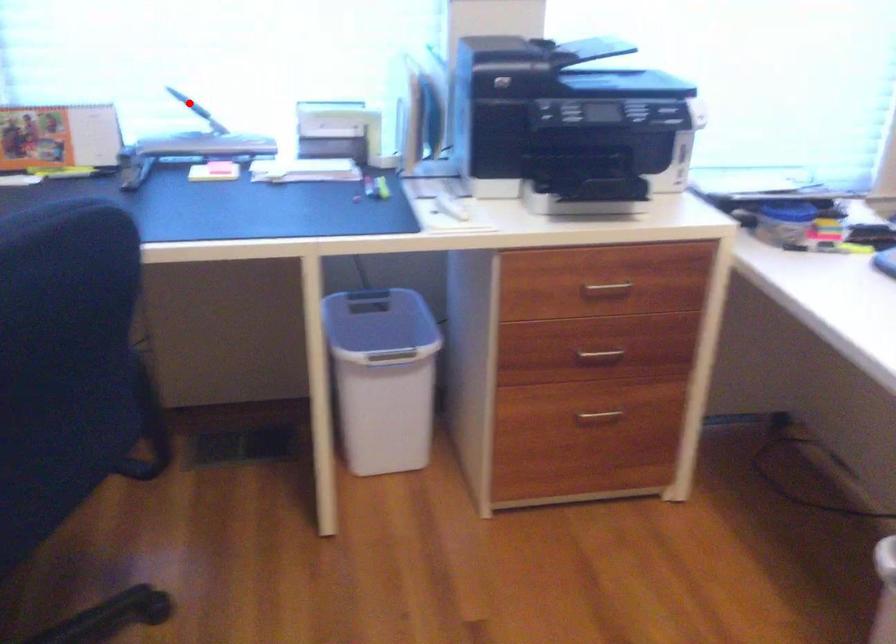
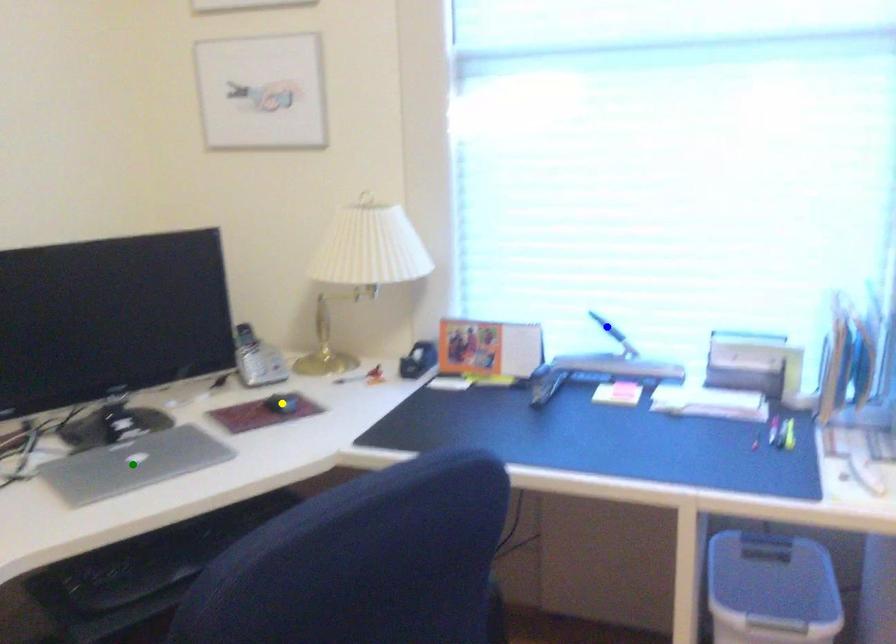
Question: I am providing you with two images of the same scene from different viewpoints. A red point is marked on the first image. You are given multiple points on the second image. Which point in image 2 represents the same 3d spot as the red point in image 1?

Choices:
 (A) green point
 (B) blue point
 (C) yellow point

Answer: (B)